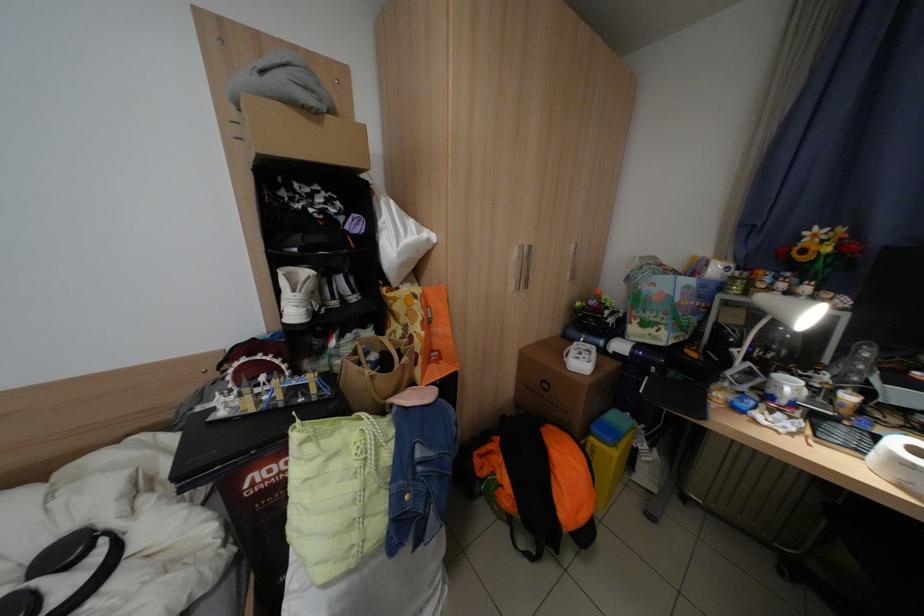
Find where to pull the wardrobe door handle. Please return your answer as a coordinate pair (x, y).

(523, 267)